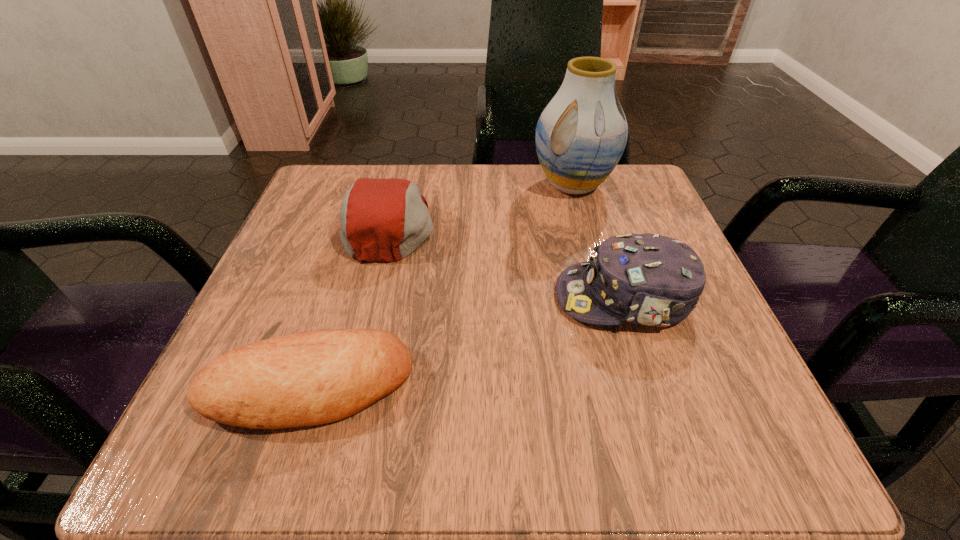
The height and width of the screenshot is (540, 960). Identify the location of vacant area in the image that satisfies the following two spatial constraints: 1. on the front-facing side of the right headwear; 2. on the front side of the nearest object. (654, 387).